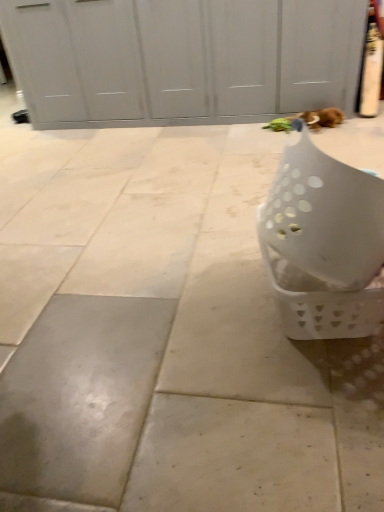
Where is `blank space to the left of white plastic basket at lower right`? blank space to the left of white plastic basket at lower right is located at coordinates (207, 309).